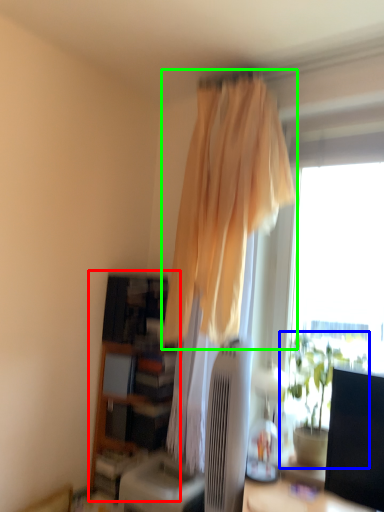
Question: Based on their relative distances, which object is nearer to bookshelf (highlighted by a red box)? Choose from houseplant (highlighted by a blue box) and curtain (highlighted by a green box).

Choices:
 (A) houseplant
 (B) curtain

Answer: (B)